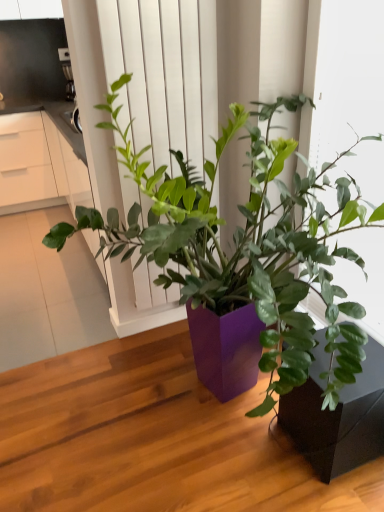
Question: Is brushed metal coffee maker at upper left to the left of white matte window frame at upper right from the viewer's perspective?

Choices:
 (A) yes
 (B) no

Answer: (A)

Question: Is brushed metal coffee maker at upper left positioned behind white matte window frame at upper right?

Choices:
 (A) no
 (B) yes

Answer: (B)

Question: Is brushed metal coffee maker at upper left wider than white matte window frame at upper right?

Choices:
 (A) no
 (B) yes

Answer: (B)

Question: Does brushed metal coffee maker at upper left have a lesser height compared to white matte window frame at upper right?

Choices:
 (A) no
 (B) yes

Answer: (B)

Question: Does brushed metal coffee maker at upper left have a smaller size compared to white matte window frame at upper right?

Choices:
 (A) no
 (B) yes

Answer: (B)

Question: Is brushed metal coffee maker at upper left thinner than white matte window frame at upper right?

Choices:
 (A) no
 (B) yes

Answer: (A)

Question: Is white matte screen door at center taller than white matte window frame at upper right?

Choices:
 (A) yes
 (B) no

Answer: (A)

Question: From a real-world perspective, is white matte screen door at center below white matte window frame at upper right?

Choices:
 (A) no
 (B) yes

Answer: (B)

Question: From the image's perspective, would you say white matte screen door at center is shown under white matte window frame at upper right?

Choices:
 (A) no
 (B) yes

Answer: (B)

Question: Can you confirm if white matte screen door at center is shorter than white matte window frame at upper right?

Choices:
 (A) yes
 (B) no

Answer: (B)

Question: Can you confirm if white matte screen door at center is bigger than white matte window frame at upper right?

Choices:
 (A) no
 (B) yes

Answer: (A)

Question: Does white matte screen door at center appear on the left side of white matte window frame at upper right?

Choices:
 (A) yes
 (B) no

Answer: (A)

Question: Could you tell me if matte black pot at lower right is facing white matte screen door at center?

Choices:
 (A) yes
 (B) no

Answer: (B)